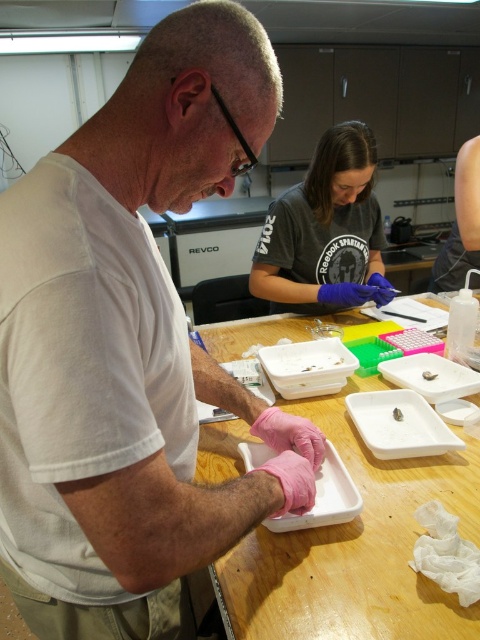
Does pink rubber gloves at left have a larger size compared to dark gray t-shirt at center?

Yes.

The height and width of the screenshot is (640, 480). What are the coordinates of `pink rubber gloves at left` in the screenshot? It's located at (131, 348).

Can you confirm if white plastic tray at center is wider than dark gray t-shirt at center?

Yes, white plastic tray at center is wider than dark gray t-shirt at center.

What do you see at coordinates (356, 548) in the screenshot? I see `white plastic tray at center` at bounding box center [356, 548].

Identify the location of white plastic tray at center. (356, 548).

Looking at this image, between pink rubber gloves at left and white plastic tray at center, which one is positioned higher?

Positioned higher is pink rubber gloves at left.

Who is more distant from viewer, [60,316] or [332,572]?

Point [332,572]

Which is behind, point (31, 170) or point (363, 602)?

The point (363, 602) is behind.

Locate an element on the screen. pink rubber gloves at left is located at coordinates (131, 348).